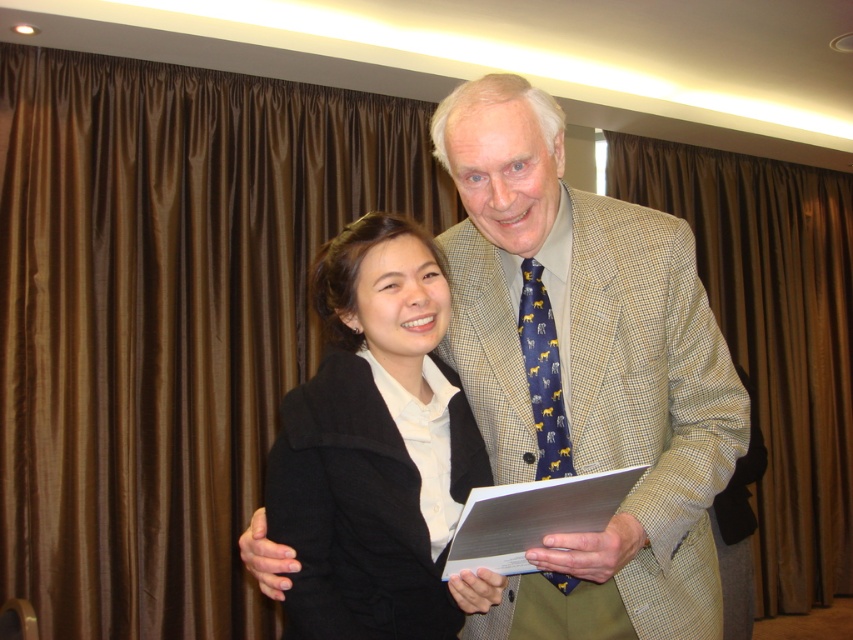
Does light beige textured blazer at center lie behind navy blue silk tie at center?

No, it is in front of navy blue silk tie at center.

Is point (717, 442) farther from camera compared to point (544, 419)?

No, (717, 442) is closer to viewer.

The width and height of the screenshot is (853, 640). Identify the location of light beige textured blazer at center. (585, 371).

Is brown satin curtain at left below brown silk curtain at right?

No.

Who is more distant from viewer, (111, 465) or (759, 356)?

The point (759, 356) is more distant.

Locate an element on the screen. Image resolution: width=853 pixels, height=640 pixels. brown satin curtain at left is located at coordinates (166, 320).

How much distance is there between black woolen coat at center and brown silk curtain at right?

black woolen coat at center is 3.38 meters away from brown silk curtain at right.

Which of these two, black woolen coat at center or brown silk curtain at right, stands shorter?

black woolen coat at center is shorter.

Who is more distant from viewer, (369,602) or (781,420)?

Positioned behind is point (781,420).

You are a GUI agent. You are given a task and a screenshot of the screen. Output one action in this format:
    pyautogui.click(x=<x>, y=<y>)
    Task: Click on the black woolen coat at center
    
    Given the screenshot: What is the action you would take?
    pyautogui.click(x=376, y=449)